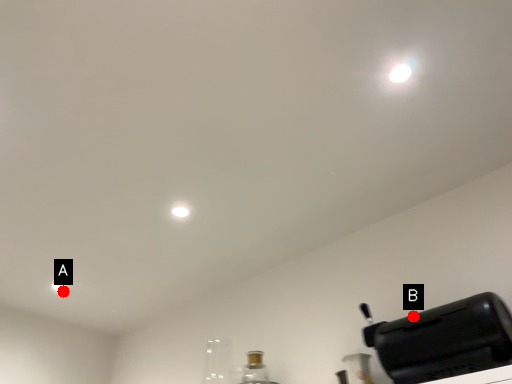
Question: Two points are circled on the image, labeled by A and B beside each circle. Which point is farther from the camera taking this photo?

Choices:
 (A) A is further
 (B) B is further

Answer: (A)